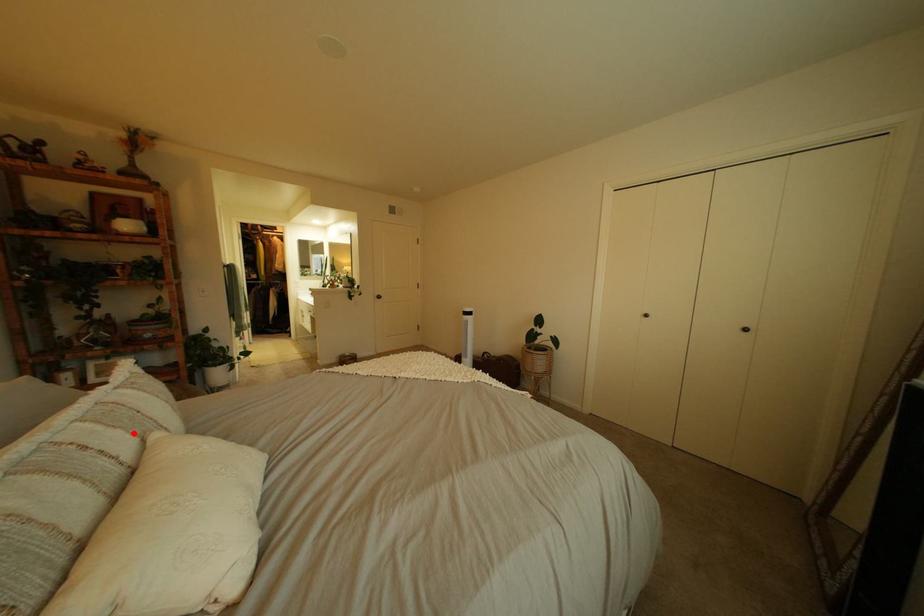
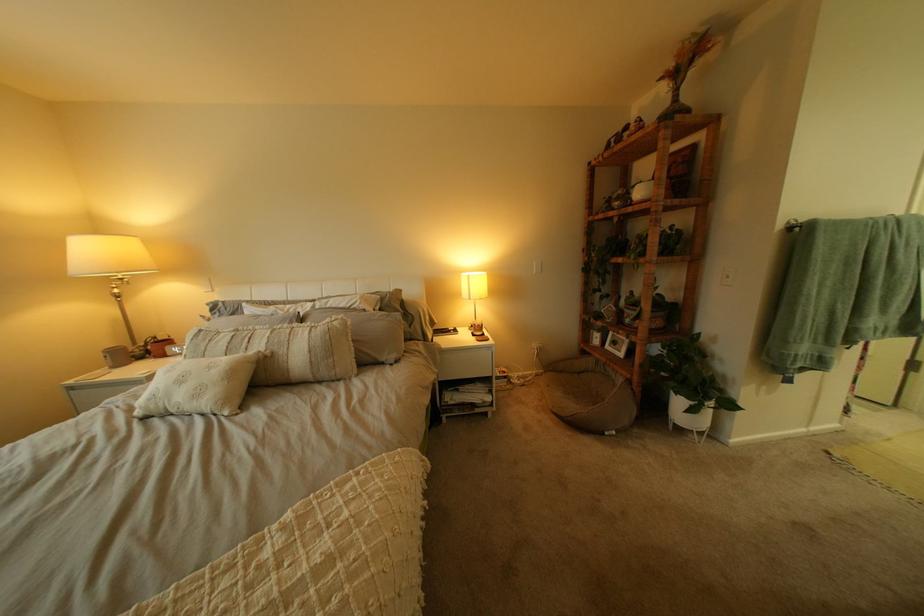
Where in the second image is the point corresponding to the highlighted location from the first image?

(281, 342)